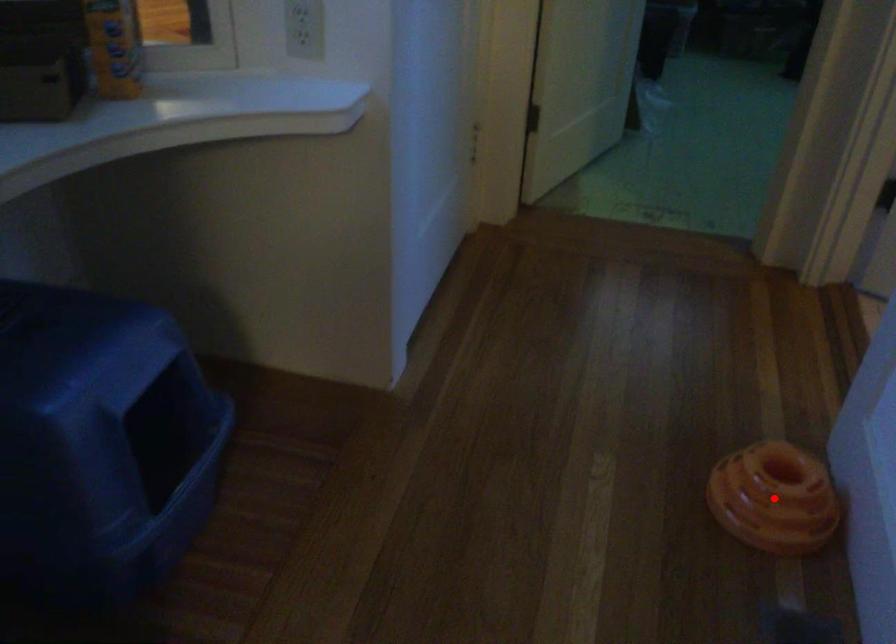
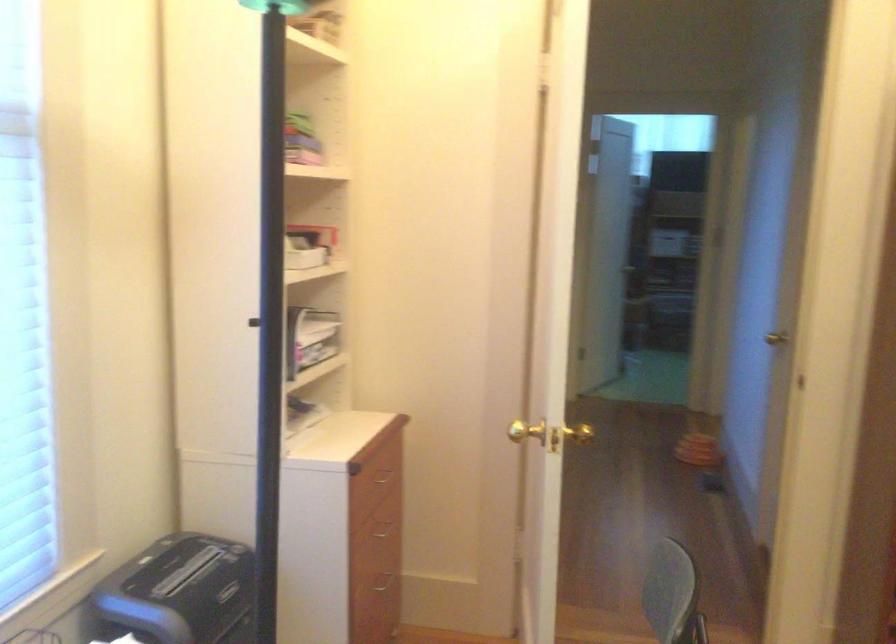
Question: I am providing you with two images of the same scene from different viewpoints. A red point is marked on the first image. Is the red point's position out of view in image 2?

Choices:
 (A) Yes
 (B) No

Answer: (A)